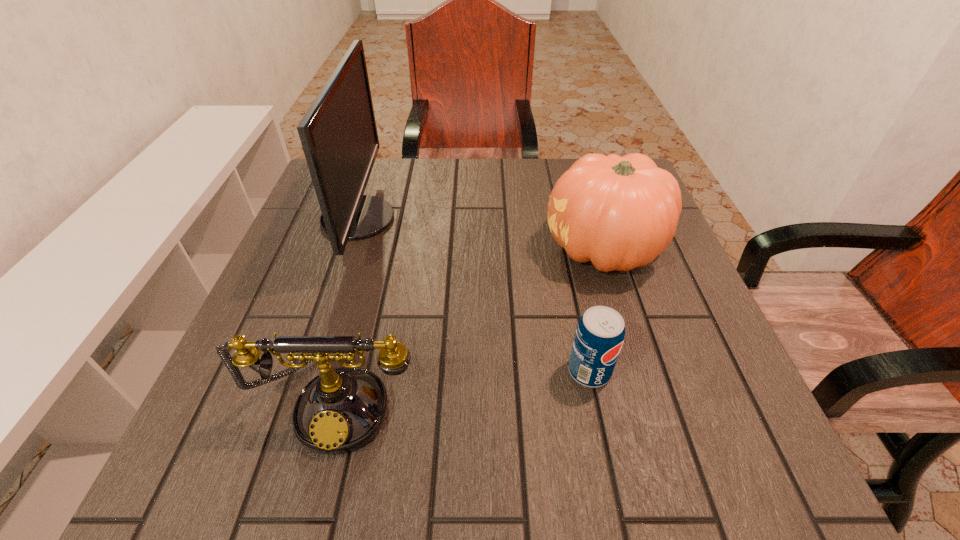
Where is `free spot between the telephone and the monitor`? This screenshot has width=960, height=540. free spot between the telephone and the monitor is located at coordinates (348, 309).

The height and width of the screenshot is (540, 960). I want to click on object that can be found as the second closest to the pumpkin, so click(341, 410).

Where is `the second closest object to the shortest object`? The height and width of the screenshot is (540, 960). the second closest object to the shortest object is located at coordinates (341, 410).

I want to click on free spot that satisfies the following two spatial constraints: 1. on the screen side of the tallest object; 2. on the left side of the pop, so click(x=307, y=371).

This screenshot has width=960, height=540. Identify the location of blank space that satisfies the following two spatial constraints: 1. on the carved face of the pumpkin; 2. on the dial of the telephone. (651, 400).